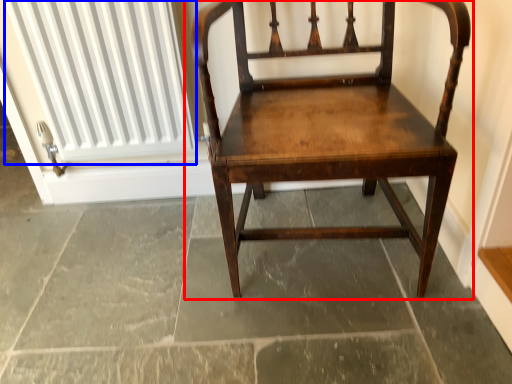
Question: Which object appears farthest to the camera in this image, chair (highlighted by a red box) or radiator (highlighted by a blue box)?

Choices:
 (A) chair
 (B) radiator

Answer: (B)